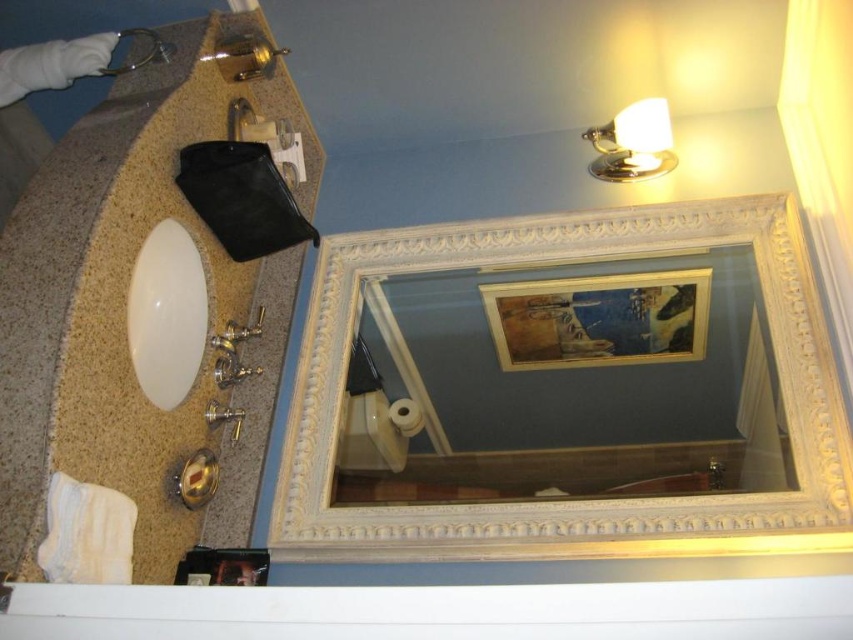
Question: Observing the image, what is the correct spatial positioning of white carved wood mirror at upper center in reference to white glossy sink at left?

Choices:
 (A) left
 (B) right

Answer: (B)

Question: Which is farther from the brushed metal faucet at upper left?

Choices:
 (A) white glossy sink at left
 (B) brushed metal faucet at lower center
 (C) white carved wood mirror at upper center

Answer: (B)

Question: Estimate the real-world distances between objects in this image. Which object is farther from the white glossy sink at left?

Choices:
 (A) brushed metal faucet at upper left
 (B) white carved wood mirror at upper center

Answer: (A)

Question: Is white glossy sink at left to the right of brushed metal faucet at lower center from the viewer's perspective?

Choices:
 (A) yes
 (B) no

Answer: (B)

Question: Which point appears farthest from the camera in this image?

Choices:
 (A) (721, 484)
 (B) (228, 122)
 (C) (151, 344)
 (D) (293, 428)

Answer: (B)

Question: Where is white carved wood mirror at upper center located in relation to brushed metal faucet at lower center in the image?

Choices:
 (A) left
 (B) right

Answer: (A)